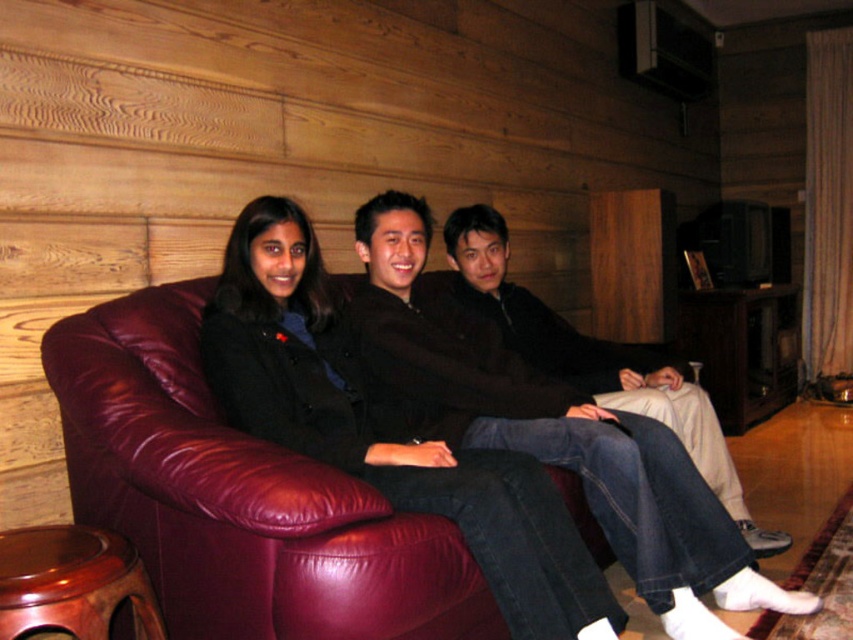
Is matte black jacket at center smaller than maroon leather couch at center?

Actually, matte black jacket at center might be larger than maroon leather couch at center.

Is matte black jacket at center positioned before maroon leather couch at center?

No, matte black jacket at center is behind maroon leather couch at center.

Locate an element on the screen. matte black jacket at center is located at coordinates (463, 429).

Does point (62, 417) come farther from viewer compared to point (514, 305)?

No, it is in front of (514, 305).

At what (x,y) coordinates should I click in order to perform the action: click on maroon leather couch at center. Please return your answer as a coordinate pair (x, y). The image size is (853, 640). Looking at the image, I should click on (239, 497).

Who is more distant from viewer, [390,580] or [593,394]?

Point [593,394]

Find the location of `maroon leather couch at center`. maroon leather couch at center is located at coordinates (239, 497).

Is maroon leather couch at center smaller than mahogany wood stool at lower left?

Actually, maroon leather couch at center might be larger than mahogany wood stool at lower left.

You are a GUI agent. You are given a task and a screenshot of the screen. Output one action in this format:
    pyautogui.click(x=<x>, y=<y>)
    Task: Click on the maroon leather couch at center
    The height and width of the screenshot is (640, 853).
    Given the screenshot: What is the action you would take?
    pyautogui.click(x=239, y=497)